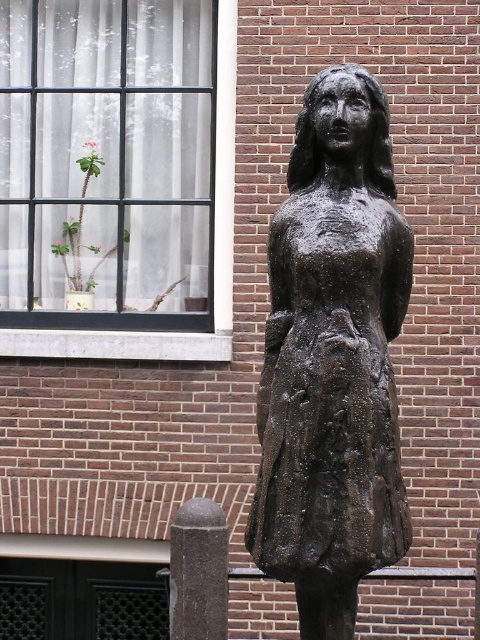
You are standing in front of a building with a brick wall. You see a bronze statue at center. Based on its position relative to the window on the left and the brick wall in the background, can you determine if the statue is closer to the window or the wall?

The bronze statue at center is located at point coordinates that place it closer to the window on the left than the brick wall in the background. Since the statue is at the center, it is positioned between the window and the wall, so it is nearer to the window.

You are standing in front of a bronze statue at center and want to take a photo. If your camera can focus on objects up to 5 meters away, will it be able to capture the statue clearly?

The bronze statue at center is 4.45 meters away from the viewer, which is within the camera focus range of up to 5 meters. Therefore, the camera can capture the statue clearly.

You are standing in front of the bronze statue at center and want to take a photo of the white sheer curtain at upper left. Which object is closer to your camera lens when you focus on the curtain?

The bronze statue at center is closer to the viewer than the white sheer curtain at upper left, so when focusing on the curtain, the statue will be in the foreground and closer to the camera lens.